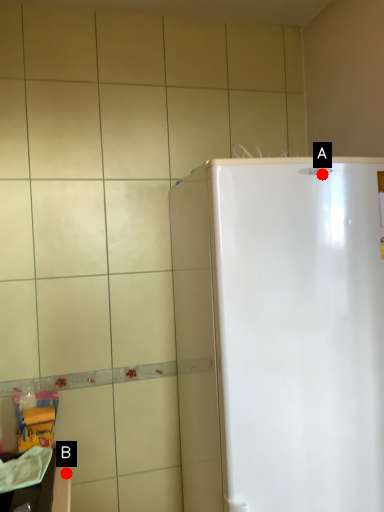
Question: Two points are circled on the image, labeled by A and B beside each circle. Which point is farther to the camera?

Choices:
 (A) A is further
 (B) B is further

Answer: (B)